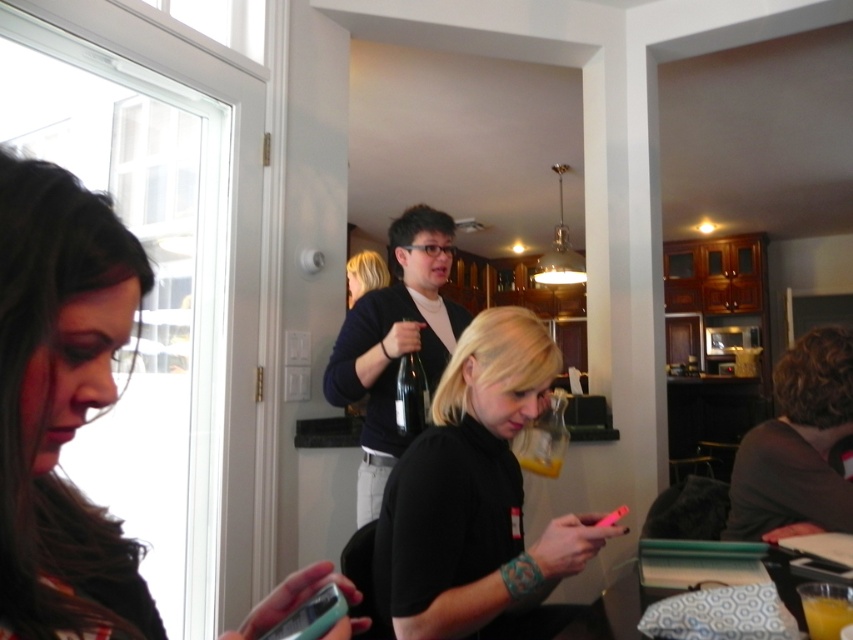
Which is above, black glass bottle at center or orange liquid at lower right?

black glass bottle at center

The image size is (853, 640). I want to click on black glass bottle at center, so click(410, 396).

Where is `black glass bottle at center`? black glass bottle at center is located at coordinates (410, 396).

Does translucent glass carafe at center appear on the right side of black glass bottle at center?

Correct, you'll find translucent glass carafe at center to the right of black glass bottle at center.

Is point (532, 442) positioned after point (408, 396)?

Yes, it is behind point (408, 396).

The width and height of the screenshot is (853, 640). In order to click on translucent glass carafe at center in this screenshot , I will do `click(543, 440)`.

Who is shorter, dark blue sweater at center or dark brown sweater at right?

dark brown sweater at right is shorter.

Measure the distance from dark blue sweater at center to dark brown sweater at right.

dark blue sweater at center is 35.14 inches from dark brown sweater at right.

At what (x,y) coordinates should I click in order to perform the action: click on dark blue sweater at center. Please return your answer as a coordinate pair (x, y). This screenshot has height=640, width=853. Looking at the image, I should click on (395, 340).

The image size is (853, 640). Identify the location of dark blue sweater at center. (395, 340).